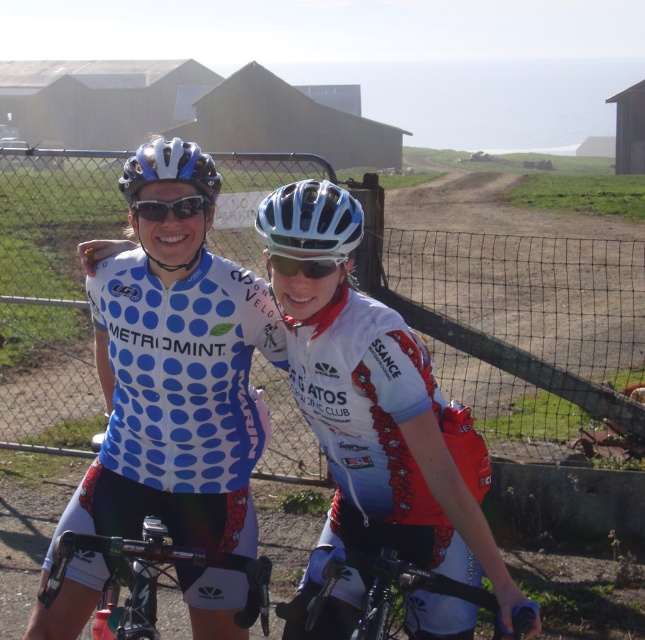
Which of these two, shiny black bicycle at center or shiny black handlebars at center, stands shorter?

shiny black bicycle at center

Who is positioned more to the left, shiny black bicycle at center or shiny black handlebars at center?

From the viewer's perspective, shiny black handlebars at center appears more on the left side.

Between point (511, 627) and point (117, 625), which one is positioned in front?

Point (511, 627) is more forward.

The image size is (645, 640). I want to click on shiny black bicycle at center, so click(x=381, y=598).

Between metal mesh fence at center and shiny black handlebars at center, which one is positioned higher?

metal mesh fence at center

Between point (611, 285) and point (104, 541), which one is positioned behind?

The point (611, 285) is behind.

This screenshot has height=640, width=645. Find the location of `metal mesh fence at center`. metal mesh fence at center is located at coordinates (513, 310).

Is point (241, 184) positioned before point (339, 259)?

No, it is not.

The image size is (645, 640). Identify the location of metal mesh fence at center. 513,310.